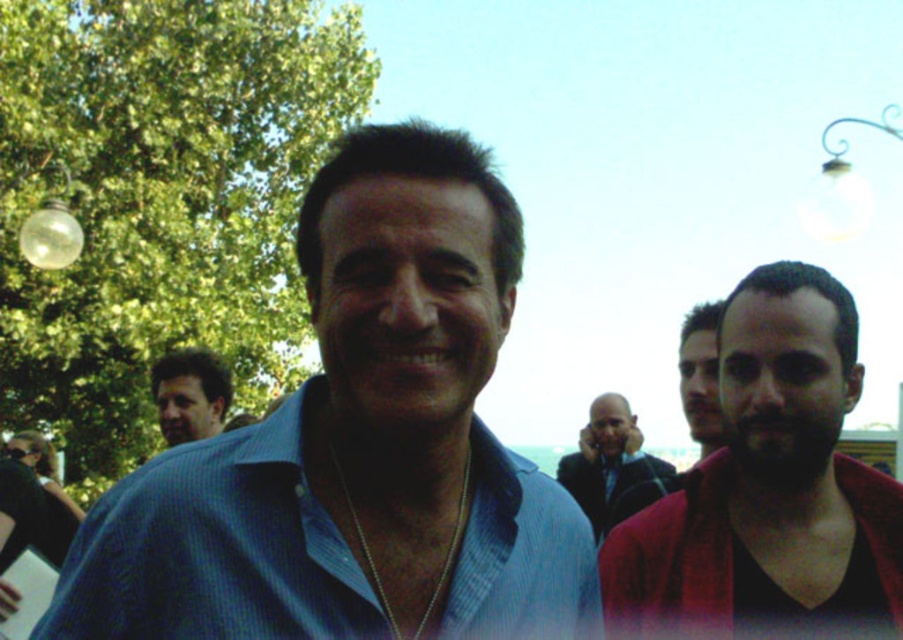
Is smooth red jacket at right below smooth black shirt at center?

Actually, smooth red jacket at right is above smooth black shirt at center.

Can you confirm if smooth red jacket at right is wider than smooth black shirt at center?

Yes.

Which is behind, point (853, 513) or point (629, 456)?

The point (629, 456) is more distant.

The height and width of the screenshot is (640, 903). I want to click on smooth red jacket at right, so click(770, 481).

Is blue textured shirt at center to the right of smooth black shirt at center from the viewer's perspective?

No, blue textured shirt at center is not to the right of smooth black shirt at center.

Is point (447, 525) positioned behind point (645, 456)?

No, it is in front of (645, 456).

Identify the location of blue textured shirt at center. Image resolution: width=903 pixels, height=640 pixels. (356, 445).

Does point (192, 419) lie in front of point (706, 362)?

No, (192, 419) is further to viewer.

What do you see at coordinates (191, 394) in the screenshot?
I see `brown leather jacket at left` at bounding box center [191, 394].

Does point (213, 424) come behind point (681, 376)?

Yes, point (213, 424) is behind point (681, 376).

This screenshot has width=903, height=640. Find the location of `brown leather jacket at left`. brown leather jacket at left is located at coordinates (191, 394).